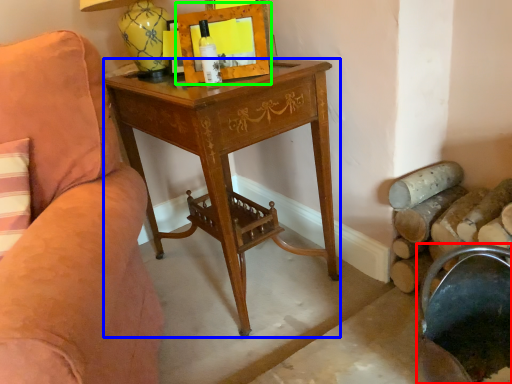
Question: Which object is the closest to the rocking chair (highlighted by a red box)? Choose among these: desk (highlighted by a blue box) or picture frame (highlighted by a green box).

Choices:
 (A) desk
 (B) picture frame

Answer: (A)